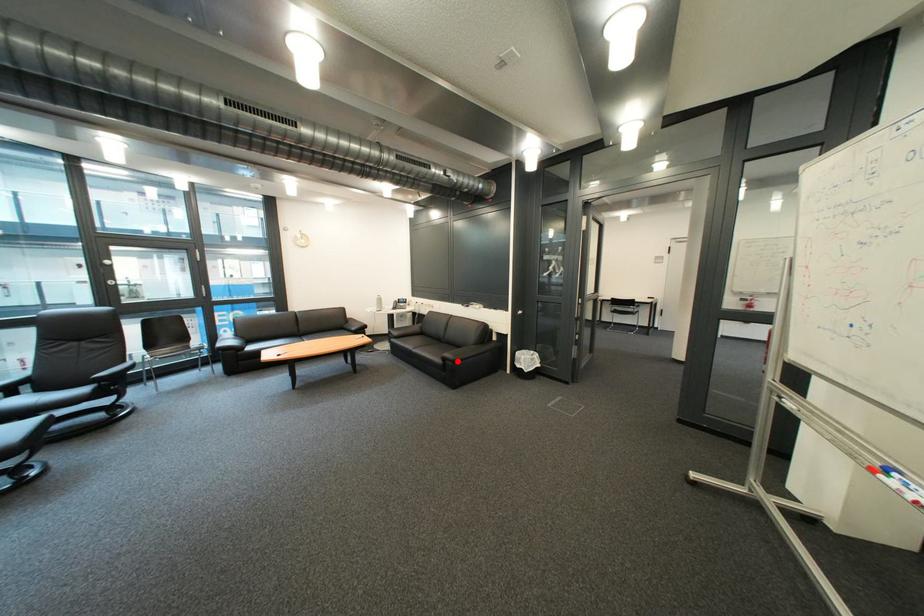
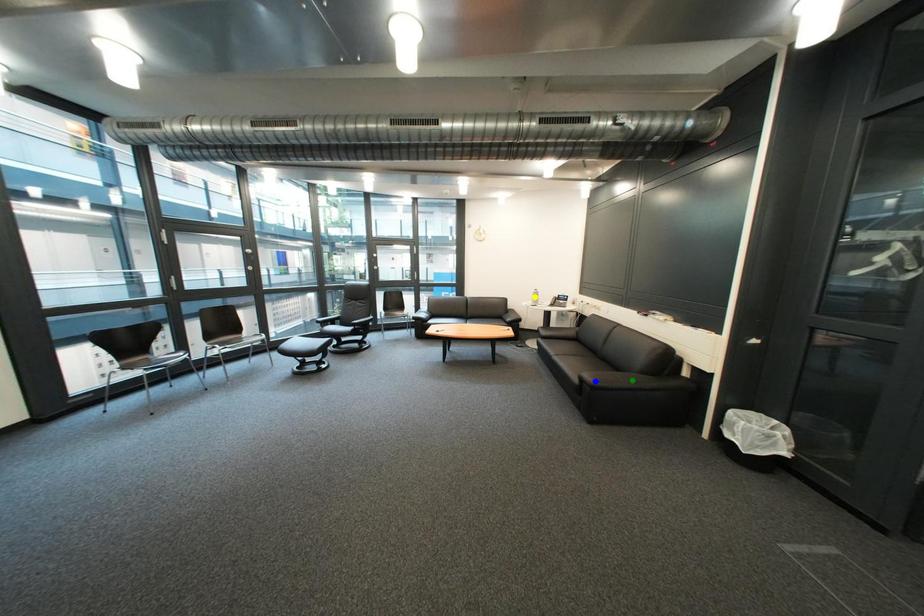
Question: I am providing you with two images of the same scene from different viewpoints. A red point is marked on the first image. You are given multiple points on the second image. Which point in image 2 is actually the same real-world point as the red point in image 1?

Choices:
 (A) blue point
 (B) yellow point
 (C) green point

Answer: (A)